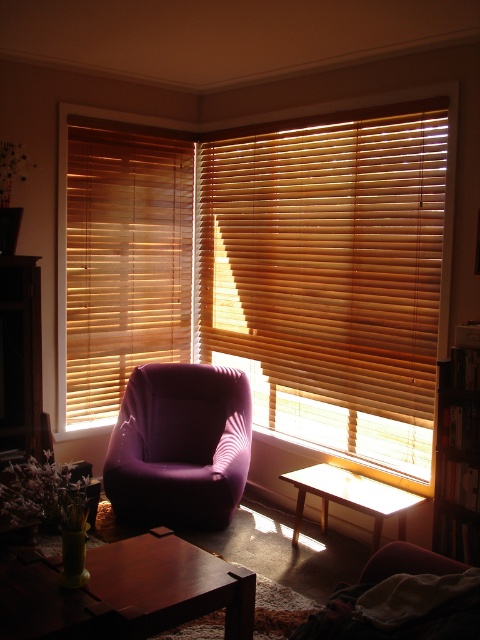
You are a delivery person trying to place a large package in the room. The package is too big to fit through the doorway. You notice the brown wooden bookshelf at right and the wooden blinds at center. Which object is closer to the doorway so you can move it aside temporarily?

The wooden blinds at center are closer to the doorway than the brown wooden bookshelf at right, so you should move the wooden blinds at center first to create space for the package.

You are trying to decide where to place a new painting that is 1 meter wide. The wooden blinds at center and the brown wooden bookshelf at right are in the way. Which object would you need to move to accommodate the painting?

The wooden blinds at center has a larger width than the brown wooden bookshelf at right, so you would need to move the brown wooden bookshelf at right to accommodate the painting since it is narrower and might have space around it.

You are sitting in the purple fabric armchair at center and want to move to the purple fabric couch at lower right. Which direction should you move to reach it?

The purple fabric couch at lower right is behind the purple fabric armchair at center, so you should move backward to reach it.